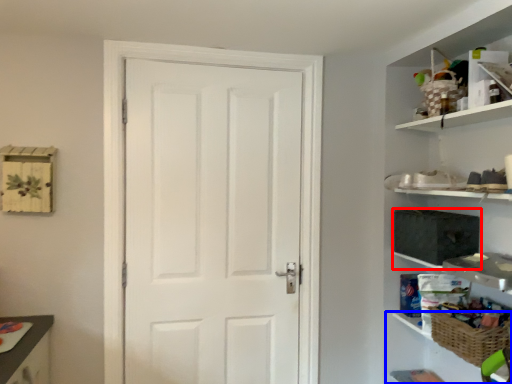
Question: Among these objects, which one is nearest to the camera, medicine cabinet (highlighted by a red box) or cabinet (highlighted by a blue box)?

Choices:
 (A) medicine cabinet
 (B) cabinet

Answer: (B)